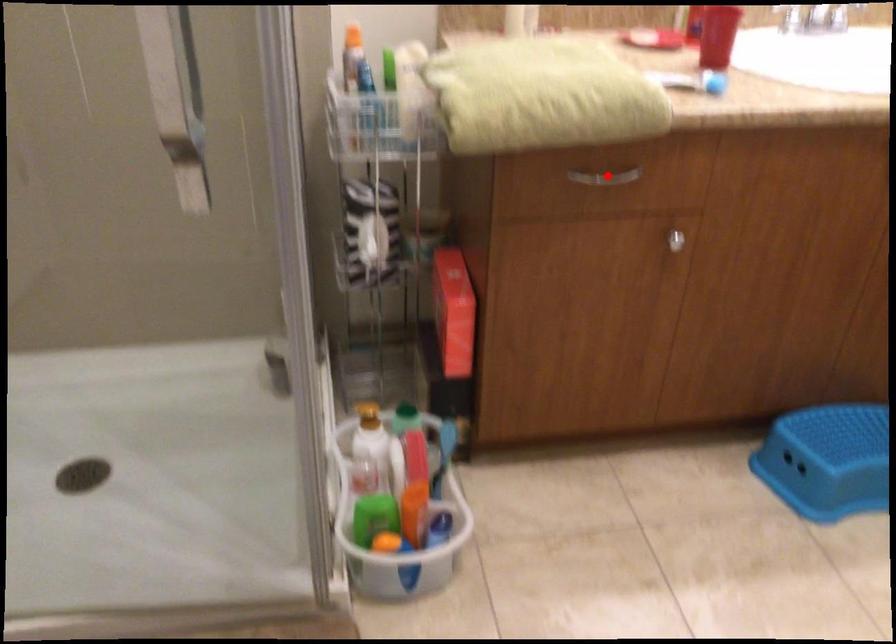
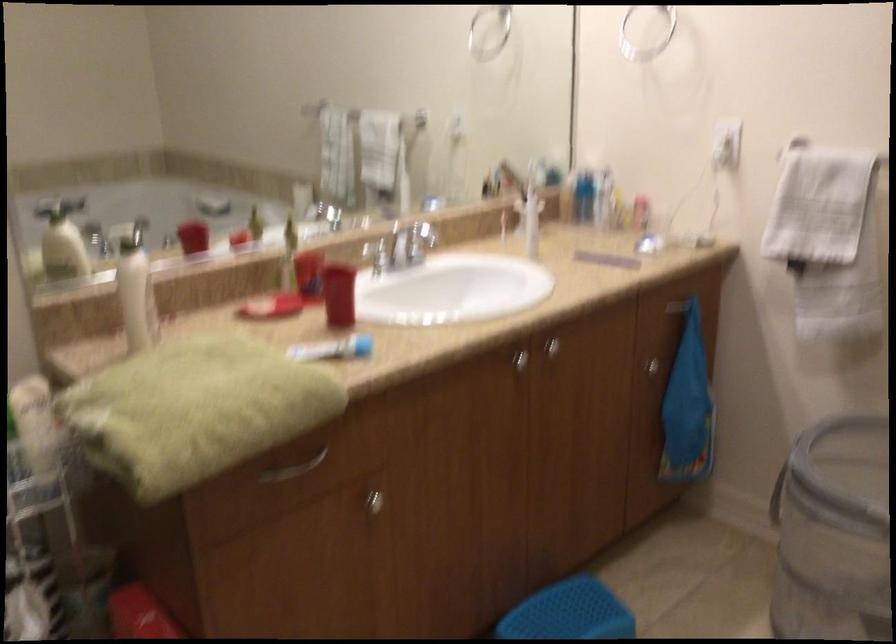
Where in the second image is the point corresponding to the highlighted location from the first image?

(294, 468)